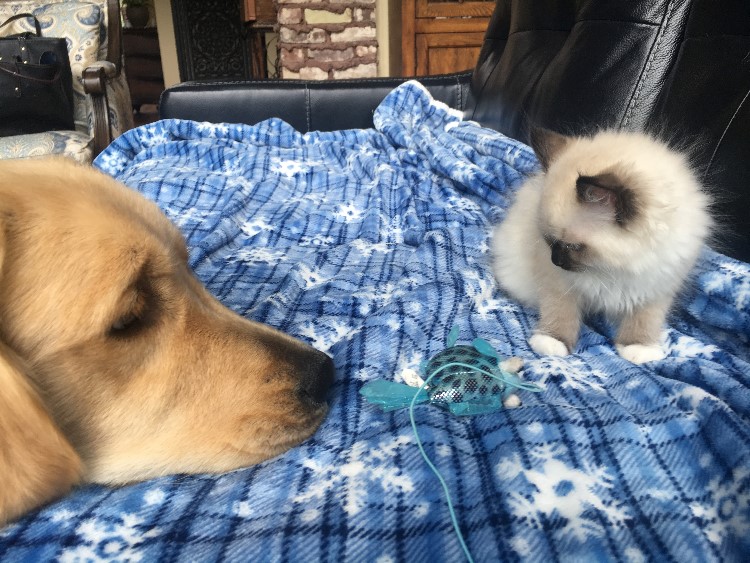
Identify the location of wall. (320, 43).